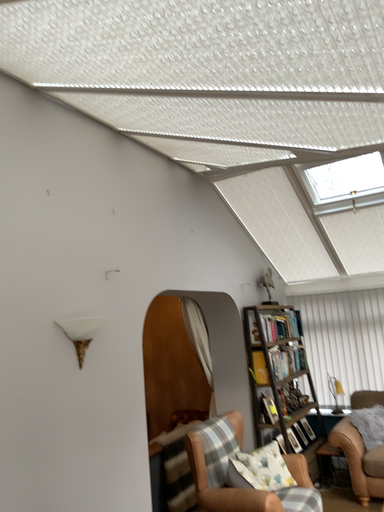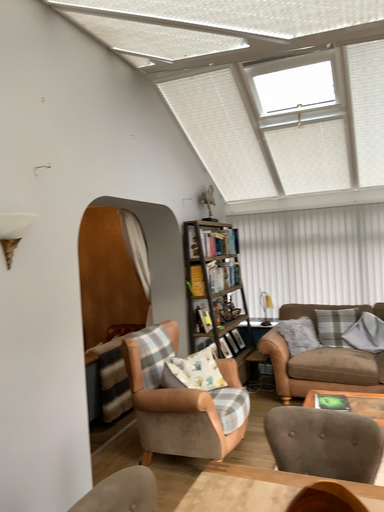
Question: Which way did the camera rotate in the video?

Choices:
 (A) rotated upward
 (B) rotated downward

Answer: (B)